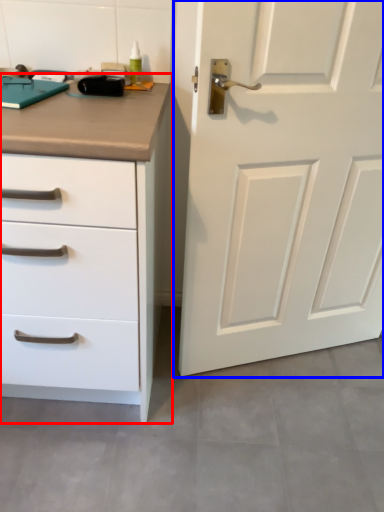
Question: Which of the following is the farthest to the observer, chest of drawers (highlighted by a red box) or door (highlighted by a blue box)?

Choices:
 (A) chest of drawers
 (B) door

Answer: (B)